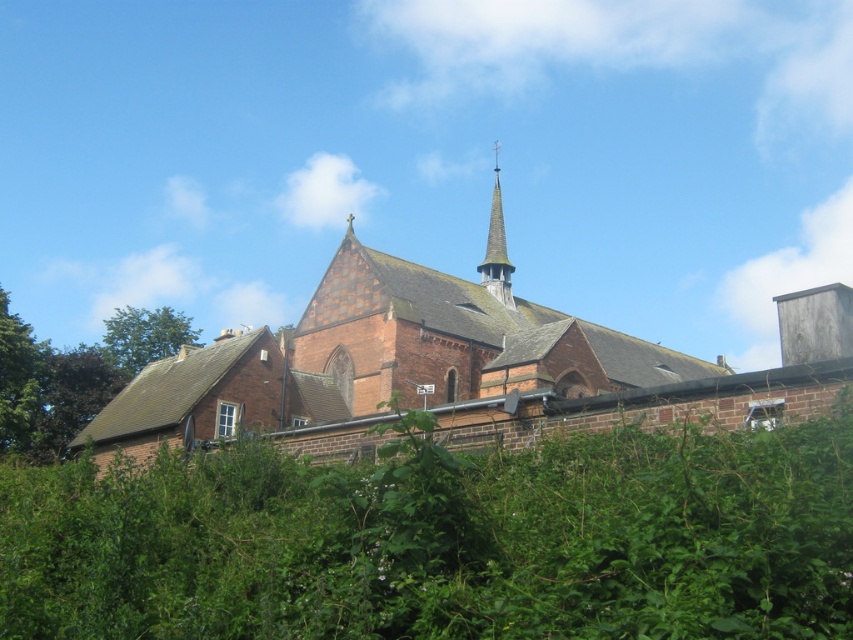
Question: Among these points, which one is nearest to the camera?

Choices:
 (A) (112, 328)
 (B) (91, 355)
 (C) (39, 403)
 (D) (495, 288)

Answer: (C)

Question: Can you confirm if red brick church at center is wider than green leafy tree at lower left?

Choices:
 (A) no
 (B) yes

Answer: (B)

Question: Which object is positioned farthest from the green leafy tree at left?

Choices:
 (A) red brick church at center
 (B) smooth gray spire at upper center

Answer: (B)

Question: Among these points, which one is farthest from the camera?

Choices:
 (A) (73, 355)
 (B) (16, 397)

Answer: (A)

Question: Is red brick church at center to the right of green leafy tree at upper left from the viewer's perspective?

Choices:
 (A) no
 (B) yes

Answer: (B)

Question: Is green leafy tree at left smaller than green leafy tree at upper left?

Choices:
 (A) no
 (B) yes

Answer: (B)